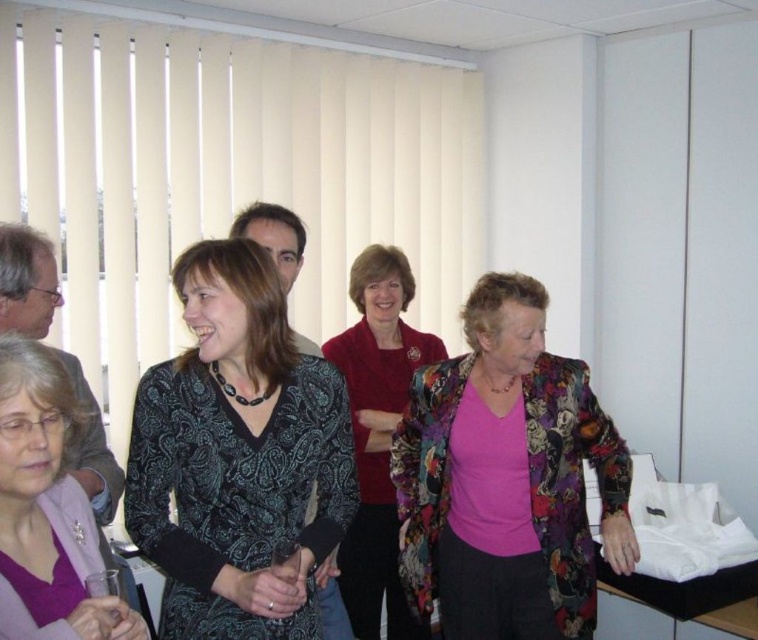
Question: Is patterned fabric dress at center positioned in front of matte red sweater at center?

Choices:
 (A) no
 (B) yes

Answer: (A)

Question: Can you confirm if patterned fabric dress at center is thinner than matte red sweater at center?

Choices:
 (A) yes
 (B) no

Answer: (A)

Question: Can you confirm if patterned fabric dress at center is smaller than matte black dress at center?

Choices:
 (A) yes
 (B) no

Answer: (B)

Question: Which point is closer to the camera taking this photo?

Choices:
 (A) (594, 576)
 (B) (44, 452)
 (C) (368, 572)
 (D) (399, 298)

Answer: (B)

Question: Which object is farther from the camera taking this photo?

Choices:
 (A) matte black dress at center
 (B) black paisley dress at center
 (C) patterned fabric dress at center

Answer: (C)

Question: Which of the following is the farthest from the observer?

Choices:
 (A) black paisley dress at center
 (B) patterned fabric dress at center
 (C) matte red sweater at center

Answer: (B)